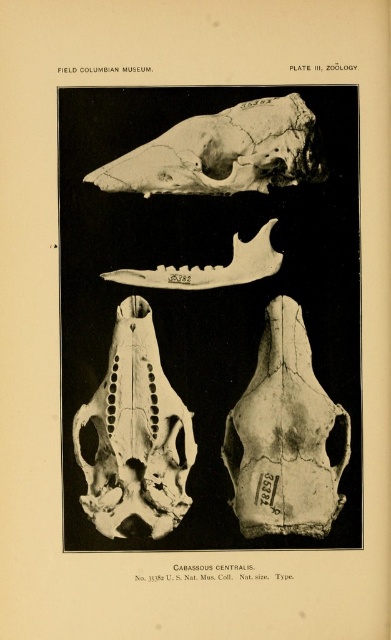
Question: Can you confirm if white bone skull at upper center is smaller than bone-like skull at center?

Choices:
 (A) no
 (B) yes

Answer: (A)

Question: Which object is the closest to the translucent bone skull at center?

Choices:
 (A) bone-like skull at center
 (B) white bone skull at upper center

Answer: (A)

Question: Which point appears closest to the camera in this image?

Choices:
 (A) (129, 420)
 (B) (279, 516)

Answer: (B)

Question: Which object appears closest to the camera in this image?

Choices:
 (A) translucent bone skull at center
 (B) bone-like skull at center
 (C) white bone skull at upper center

Answer: (A)

Question: Considering the relative positions of white bone skull at upper center and bone-like skull at center in the image provided, where is white bone skull at upper center located with respect to bone-like skull at center?

Choices:
 (A) left
 (B) right

Answer: (A)

Question: Does white bone skull at upper center have a larger size compared to bone-like skull at center?

Choices:
 (A) yes
 (B) no

Answer: (A)